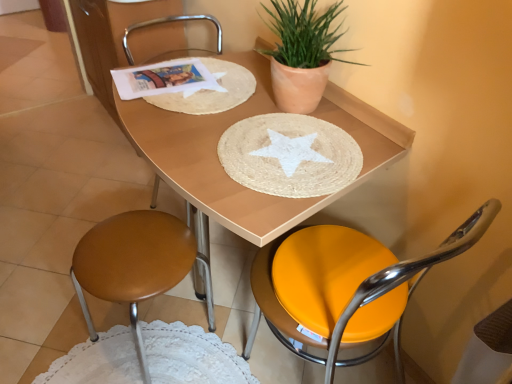
At what (x,y) coordinates should I click in order to perform the action: click on orange leather chair at center, placed as the third chair when sorted from left to right. Please return your answer as a coordinate pair (x, y). The height and width of the screenshot is (384, 512). Looking at the image, I should click on (344, 286).

What do you see at coordinates (164, 79) in the screenshot? Image resolution: width=512 pixels, height=384 pixels. I see `white paper at upper left` at bounding box center [164, 79].

What is the approximate height of metallic silver chair at center, marked as the 2th chair in a left-to-right arrangement?

metallic silver chair at center, marked as the 2th chair in a left-to-right arrangement, is 33.20 inches tall.

Image resolution: width=512 pixels, height=384 pixels. What do you see at coordinates (211, 91) in the screenshot?
I see `white woven placemat at upper left, which is the 1th paper plate from top to bottom` at bounding box center [211, 91].

Find the location of a particular element. The width and height of the screenshot is (512, 384). terracotta clay pot at upper right is located at coordinates (302, 53).

Considering the relative positions of metallic silver chair at center, the second chair in the right-to-left sequence, and terracotta clay pot at upper right in the image provided, is metallic silver chair at center, the second chair in the right-to-left sequence, to the left or to the right of terracotta clay pot at upper right?

Based on their positions, metallic silver chair at center, the second chair in the right-to-left sequence, is located to the left of terracotta clay pot at upper right.

Is metallic silver chair at center, marked as the 2th chair in a left-to-right arrangement, facing towards terracotta clay pot at upper right?

Yes, metallic silver chair at center, marked as the 2th chair in a left-to-right arrangement, is facing terracotta clay pot at upper right.

Based on the photo, can you confirm if metallic silver chair at center, the second chair in the right-to-left sequence, is shorter than terracotta clay pot at upper right?

In fact, metallic silver chair at center, the second chair in the right-to-left sequence, may be taller than terracotta clay pot at upper right.

Is wooden placemat at center aimed at white woven placemat at upper left, which is the 1th paper plate from top to bottom?

No, wooden placemat at center is not oriented towards white woven placemat at upper left, which is the 1th paper plate from top to bottom.

Which of these two, wooden placemat at center or white woven placemat at upper left, the second paper plate when ordered from bottom to top, is smaller?

With smaller size is white woven placemat at upper left, the second paper plate when ordered from bottom to top.

Does wooden placemat at center have a lesser height compared to white woven placemat at upper left, the second paper plate when ordered from bottom to top?

In fact, wooden placemat at center may be taller than white woven placemat at upper left, the second paper plate when ordered from bottom to top.

Measure the distance between white paper at upper left and orange leather chair at center, placed as the third chair when sorted from left to right.

They are 25.94 inches apart.

From the image's perspective, between white paper at upper left and orange leather chair at center, the first chair positioned from the right, which one is located above?

white paper at upper left.

Is white paper at upper left next to orange leather chair at center, placed as the third chair when sorted from left to right?

No, white paper at upper left is not touching orange leather chair at center, placed as the third chair when sorted from left to right.

Does white paper at upper left lie behind orange leather chair at center, the first chair positioned from the right?

That is True.

Looking at their sizes, would you say terracotta clay pot at upper right is wider or thinner than white paper at upper left?

Clearly, terracotta clay pot at upper right has less width compared to white paper at upper left.

Consider the image. Is terracotta clay pot at upper right far from white paper at upper left?

They are positioned close to each other.

Is terracotta clay pot at upper right smaller than white paper at upper left?

No, terracotta clay pot at upper right is not smaller than white paper at upper left.

Where is `the 2nd chair located beneath the terracotta clay pot at upper right (from a real-world perspective)`? The image size is (512, 384). the 2nd chair located beneath the terracotta clay pot at upper right (from a real-world perspective) is located at coordinates (344, 286).

Do you think orange leather chair at center, placed as the third chair when sorted from left to right, is within terracotta clay pot at upper right, or outside of it?

orange leather chair at center, placed as the third chair when sorted from left to right, is spatially situated outside terracotta clay pot at upper right.

Can you confirm if orange leather chair at center, the first chair positioned from the right, is thinner than terracotta clay pot at upper right?

Incorrect, the width of orange leather chair at center, the first chair positioned from the right, is not less than that of terracotta clay pot at upper right.

Is point (482, 211) positioned in front of point (324, 67)?

That is True.

What's the angular difference between terracotta clay pot at upper right and orange leather chair at center, placed as the third chair when sorted from left to right,'s facing directions?

There is a 90.2-degree angle between the facing directions of terracotta clay pot at upper right and orange leather chair at center, placed as the third chair when sorted from left to right.

Is orange leather chair at center, placed as the third chair when sorted from left to right, at the back of terracotta clay pot at upper right?

No, orange leather chair at center, placed as the third chair when sorted from left to right, is not at the back of terracotta clay pot at upper right.

From a real-world perspective, is terracotta clay pot at upper right positioned under orange leather chair at center, the first chair positioned from the right, based on gravity?

No, from a real-world perspective, terracotta clay pot at upper right is not beneath orange leather chair at center, the first chair positioned from the right.

Based on the photo, is white paper at upper left turned away from terracotta clay pot at upper right?

No, terracotta clay pot at upper right is not at the back of white paper at upper left.

Which is less distant, (196, 84) or (329, 9)?

Point (196, 84) is farther from the camera than point (329, 9).

From a real-world perspective, is white paper at upper left beneath terracotta clay pot at upper right?

Indeed, from a real-world perspective, white paper at upper left is positioned beneath terracotta clay pot at upper right.

From the image's perspective, which one is positioned higher, white paper at upper left or terracotta clay pot at upper right?

From the image's view, terracotta clay pot at upper right is above.

Image resolution: width=512 pixels, height=384 pixels. I want to click on houseplant located in front of the metallic silver chair at center, the second chair in the right-to-left sequence, so click(x=302, y=53).

This screenshot has width=512, height=384. Identify the location of paper plate that appears on the left of wooden placemat at center. (211, 91).

When comparing their distances from metallic silver chair at center, the second chair in the right-to-left sequence, does white woven placemat at upper left, the second paper plate when ordered from bottom to top, or wooden seat at lower left, the 3th chair in the right-to-left sequence, seem further?

Among the two, wooden seat at lower left, the 3th chair in the right-to-left sequence, is located further to metallic silver chair at center, the second chair in the right-to-left sequence.

Considering their positions, is white paper at upper left positioned further to wooden seat at lower left, the 3th chair in the right-to-left sequence, than white woven placemat at upper left, the second paper plate when ordered from bottom to top?

white paper at upper left is further to wooden seat at lower left, the 3th chair in the right-to-left sequence.

Which object lies nearer to the anchor point wooden seat at lower left, the first chair positioned from the left, metallic silver chair at center, the second chair in the right-to-left sequence, or natural fiber placemat at center, the first paper plate positioned from the bottom?

natural fiber placemat at center, the first paper plate positioned from the bottom.

Which object lies nearer to the anchor point orange leather chair at center, the first chair positioned from the right, terracotta clay pot at upper right or white paper at upper left?

terracotta clay pot at upper right is closer to orange leather chair at center, the first chair positioned from the right.

Estimate the real-world distances between objects in this image. Which object is closer to orange leather chair at center, placed as the third chair when sorted from left to right, wooden seat at lower left, the first chair positioned from the left, or wooden placemat at center?

Based on the image, wooden placemat at center appears to be nearer to orange leather chair at center, placed as the third chair when sorted from left to right.

From the image, which object appears to be farther from white woven placemat at upper left, which is the 1th paper plate from top to bottom, terracotta clay pot at upper right or white paper at upper left?

terracotta clay pot at upper right is positioned further to the anchor white woven placemat at upper left, which is the 1th paper plate from top to bottom.

Based on the photo, estimate the real-world distances between objects in this image. Which object is further from white woven placemat at upper left, the second paper plate when ordered from bottom to top, metallic silver chair at center, the second chair in the right-to-left sequence, or natural fiber placemat at center, the first paper plate positioned from the bottom?

metallic silver chair at center, the second chair in the right-to-left sequence.

Estimate the real-world distances between objects in this image. Which object is further from wooden seat at lower left, the first chair positioned from the left, orange leather chair at center, the first chair positioned from the right, or white woven placemat at upper left, which is the 1th paper plate from top to bottom?

The object further to wooden seat at lower left, the first chair positioned from the left, is white woven placemat at upper left, which is the 1th paper plate from top to bottom.

At what (x,y) coordinates should I click in order to perform the action: click on paper plate between white paper at upper left and natural fiber placemat at center, the first paper plate positioned from the bottom, in the horizontal direction. Please return your answer as a coordinate pair (x, y). Looking at the image, I should click on (211, 91).

In order to click on table between wooden seat at lower left, the 3th chair in the right-to-left sequence, and orange leather chair at center, placed as the third chair when sorted from left to right, in the horizontal direction in this screenshot , I will do `click(222, 167)`.

I want to click on magazine between terracotta clay pot at upper right and orange leather chair at center, the first chair positioned from the right, from top to bottom, so click(164, 79).

This screenshot has width=512, height=384. I want to click on magazine between terracotta clay pot at upper right and wooden placemat at center in the up-down direction, so (164, 79).